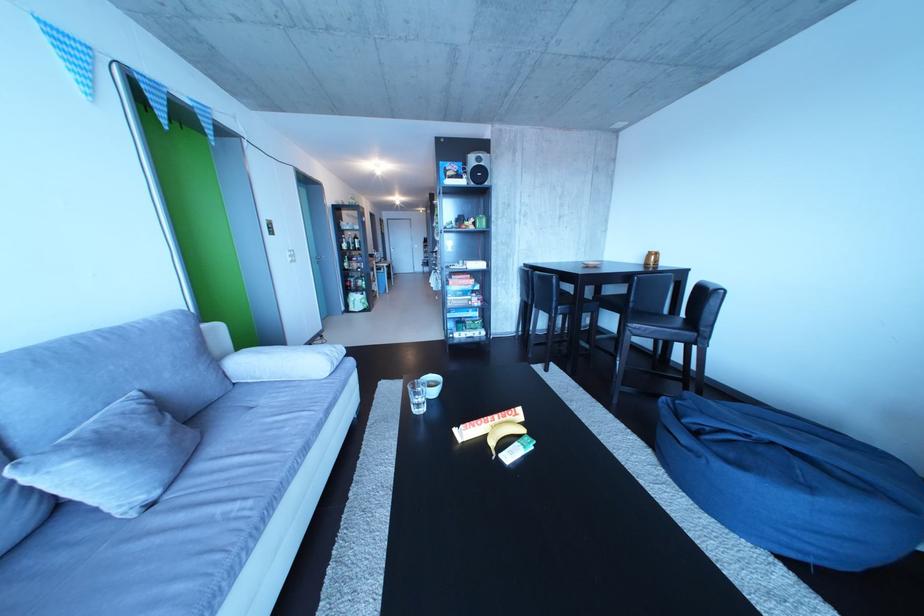
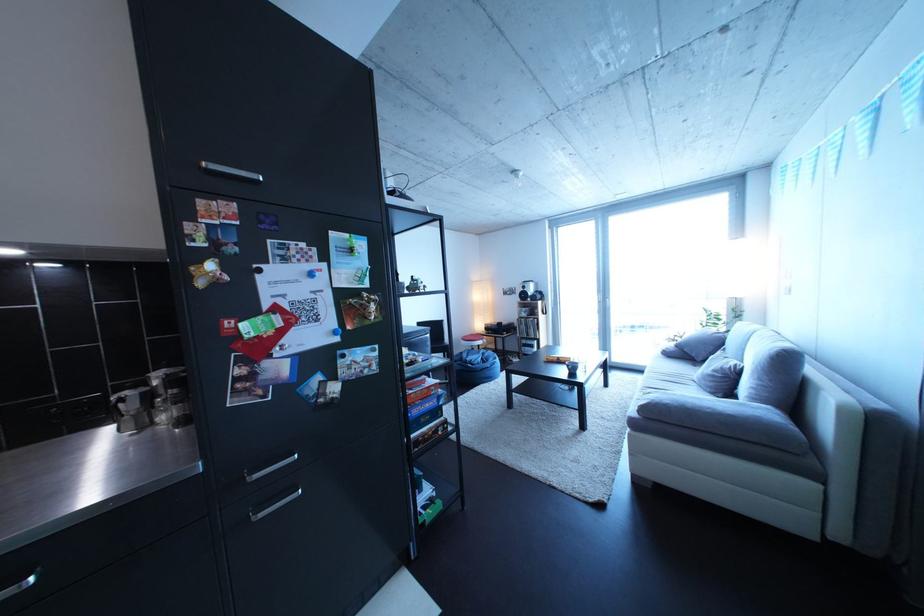
Find the pixel in the second image that matches the point at 174,429 in the first image.

(727, 377)